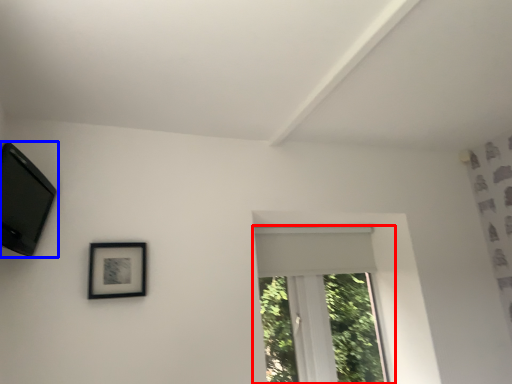
Question: Which object is closer to the camera taking this photo, window (highlighted by a red box) or picture frame (highlighted by a blue box)?

Choices:
 (A) window
 (B) picture frame

Answer: (B)